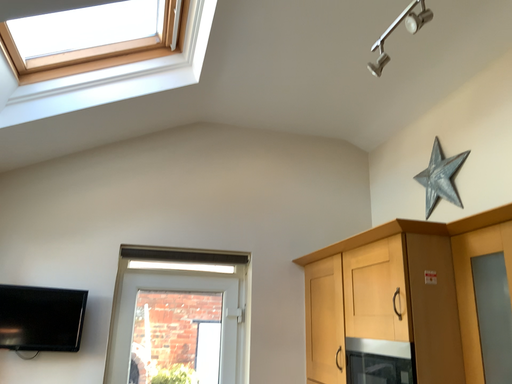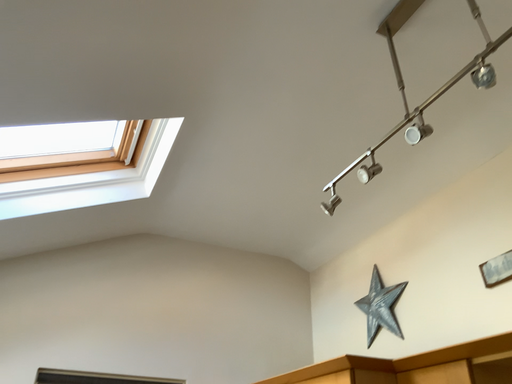
Question: How did the camera likely rotate when shooting the video?

Choices:
 (A) rotated left
 (B) rotated right

Answer: (B)